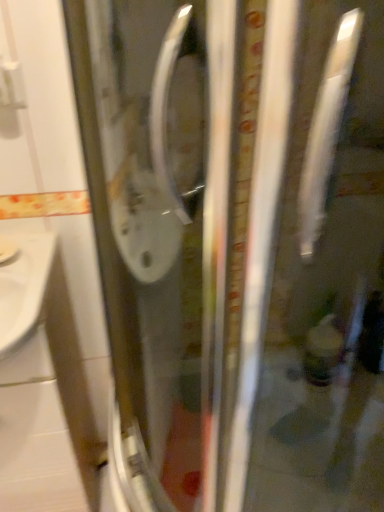
What do you see at coordinates (42, 387) in the screenshot? I see `white glossy sink at lower left` at bounding box center [42, 387].

This screenshot has width=384, height=512. What are the coordinates of `white glossy sink at lower left` in the screenshot? It's located at (42, 387).

You are a GUI agent. You are given a task and a screenshot of the screen. Output one action in this format:
    pyautogui.click(x=<x>, y=<y>)
    Task: Click on the white glossy sink at lower left
    The width and height of the screenshot is (384, 512).
    Given the screenshot: What is the action you would take?
    pyautogui.click(x=42, y=387)